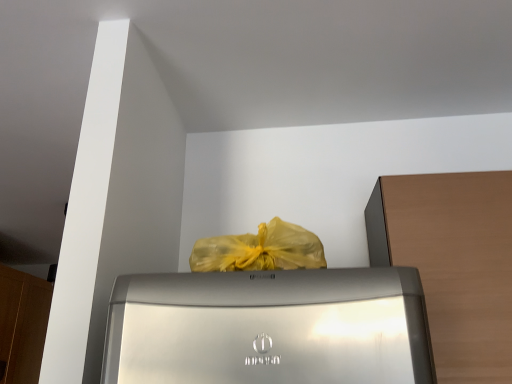
Question: Does brown wood cabinet at right, which ranks as the 1th cabinetry in front-to-back order, have a lesser width compared to wooden cabinet at left, the second cabinetry viewed from the front?

Choices:
 (A) yes
 (B) no

Answer: (B)

Question: Is brown wood cabinet at right, placed as the 2th cabinetry when sorted from back to front, aimed at wooden cabinet at left, the 1th cabinetry when ordered from back to front?

Choices:
 (A) no
 (B) yes

Answer: (A)

Question: Is brown wood cabinet at right, which ranks as the 1th cabinetry in front-to-back order, not close to wooden cabinet at left, the second cabinetry viewed from the front?

Choices:
 (A) yes
 (B) no

Answer: (A)

Question: Can you confirm if brown wood cabinet at right, the 1th cabinetry positioned from the right, is bigger than wooden cabinet at left, which appears as the 1th cabinetry when viewed from the left?

Choices:
 (A) yes
 (B) no

Answer: (A)

Question: Can you confirm if brown wood cabinet at right, placed as the 2th cabinetry when sorted from back to front, is smaller than wooden cabinet at left, the second cabinetry viewed from the front?

Choices:
 (A) no
 (B) yes

Answer: (A)

Question: Is the position of brown wood cabinet at right, the 1th cabinetry positioned from the right, more distant than that of wooden cabinet at left, which appears as the 1th cabinetry when viewed from the left?

Choices:
 (A) yes
 (B) no

Answer: (B)

Question: Does wooden cabinet at left, the second cabinetry viewed from the front, appear on the right side of brown wood cabinet at right, which appears as the second cabinetry when viewed from the left?

Choices:
 (A) yes
 (B) no

Answer: (B)

Question: Is wooden cabinet at left, which appears as the 1th cabinetry when viewed from the left, not inside brown wood cabinet at right, the 1th cabinetry positioned from the right?

Choices:
 (A) no
 (B) yes

Answer: (B)

Question: Does wooden cabinet at left, the second cabinetry viewed from the front, have a lesser width compared to brown wood cabinet at right, which appears as the second cabinetry when viewed from the left?

Choices:
 (A) yes
 (B) no

Answer: (A)

Question: Does wooden cabinet at left, which appears as the 1th cabinetry when viewed from the left, contain brown wood cabinet at right, placed as the 2th cabinetry when sorted from back to front?

Choices:
 (A) no
 (B) yes

Answer: (A)

Question: Is wooden cabinet at left, which appears as the 1th cabinetry when viewed from the left, further to the viewer compared to brown wood cabinet at right, placed as the 2th cabinetry when sorted from back to front?

Choices:
 (A) no
 (B) yes

Answer: (B)

Question: From a real-world perspective, is wooden cabinet at left, positioned as the second cabinetry in right-to-left order, on top of brown wood cabinet at right, the 1th cabinetry positioned from the right?

Choices:
 (A) no
 (B) yes

Answer: (B)

Question: Is brown wood cabinet at right, which ranks as the 1th cabinetry in front-to-back order, taller or shorter than wooden cabinet at left, which appears as the 1th cabinetry when viewed from the left?

Choices:
 (A) tall
 (B) short

Answer: (B)